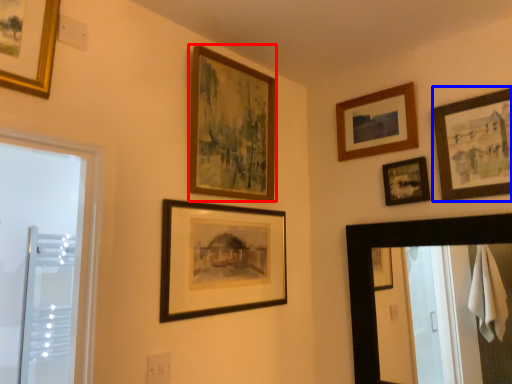
Question: Which object is further to the camera taking this photo, picture frame (highlighted by a red box) or picture frame (highlighted by a blue box)?

Choices:
 (A) picture frame
 (B) picture frame

Answer: (A)